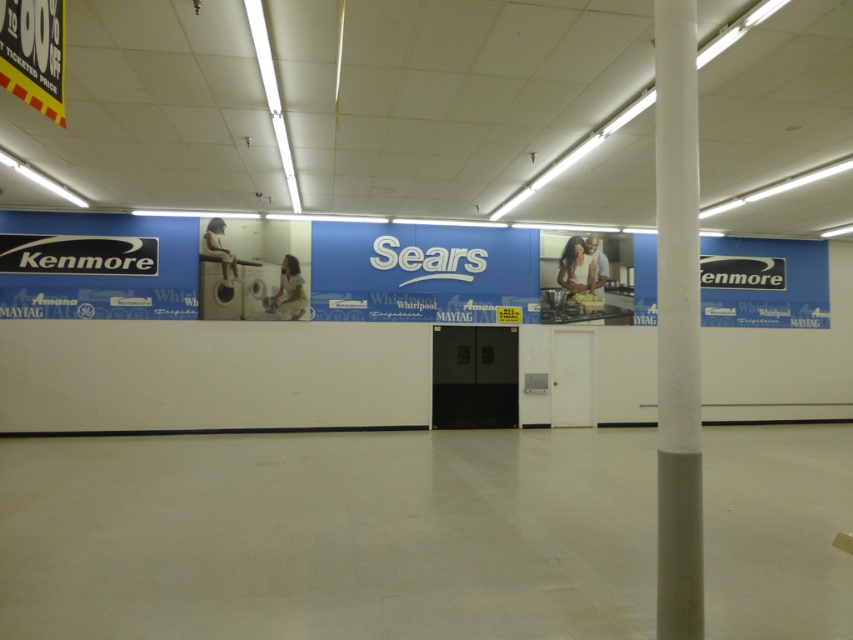
Can you confirm if white smooth pole at right is taller than blue matte kenmore sign at upper right?

Indeed, white smooth pole at right has a greater height compared to blue matte kenmore sign at upper right.

Is point (674, 252) behind point (817, 250)?

No.

Who is more distant from viewer, (656, 60) or (708, 294)?

The point (708, 294) is more distant.

Find the location of a particular element. The height and width of the screenshot is (640, 853). white smooth pole at right is located at coordinates (677, 324).

Based on the photo, can you confirm if white smooth pole at right is taller than matte black sign at left?

Yes.

Is white smooth pole at right in front of matte black sign at left?

Yes, it is.

Describe the element at coordinates (677, 324) in the screenshot. I see `white smooth pole at right` at that location.

What are the coordinates of `white smooth pole at right` in the screenshot? It's located at (677, 324).

Is point (680, 52) less distant than point (451, 246)?

Yes, it is in front of point (451, 246).

Can you confirm if white smooth pole at right is wider than white matte sign at center?

No.

Which is in front, point (677, 579) or point (480, 246)?

Point (677, 579)

I want to click on white smooth pole at right, so click(x=677, y=324).